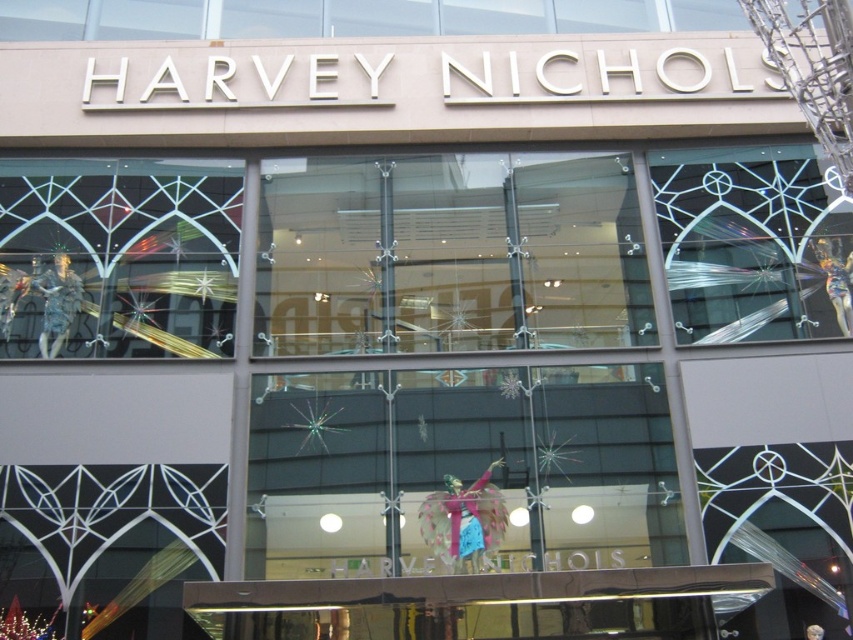
Who is shorter, transparent glass angel at center or clear glass window at upper right?

With less height is clear glass window at upper right.

Does transparent glass angel at center appear on the left side of clear glass window at upper right?

Yes, transparent glass angel at center is to the left of clear glass window at upper right.

Between point (602, 400) and point (846, 288), which one is positioned behind?

The point (846, 288) is more distant.

Identify the location of transparent glass angel at center. (456, 364).

Is point (579, 364) farther from camera compared to point (204, 330)?

That is False.

Does transparent glass angel at center appear over metallic silver mannequin at left?

Actually, transparent glass angel at center is below metallic silver mannequin at left.

This screenshot has height=640, width=853. What are the coordinates of `transparent glass angel at center` in the screenshot? It's located at (456, 364).

Does metallic silver mannequin at left appear on the left side of clear glass window at upper right?

Indeed, metallic silver mannequin at left is positioned on the left side of clear glass window at upper right.

Can you confirm if metallic silver mannequin at left is bigger than clear glass window at upper right?

Yes.

Where is `metallic silver mannequin at left`? This screenshot has width=853, height=640. metallic silver mannequin at left is located at coordinates (119, 257).

Image resolution: width=853 pixels, height=640 pixels. In order to click on metallic silver mannequin at left in this screenshot , I will do `click(119, 257)`.